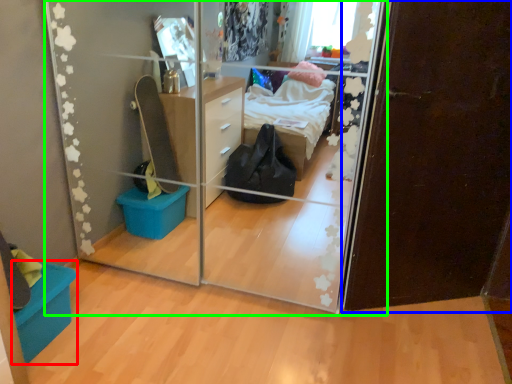
Question: Considering the real-world distances, which object is closest to storage box (highlighted by a red box)? door (highlighted by a blue box) or glass door (highlighted by a green box).

Choices:
 (A) door
 (B) glass door

Answer: (B)